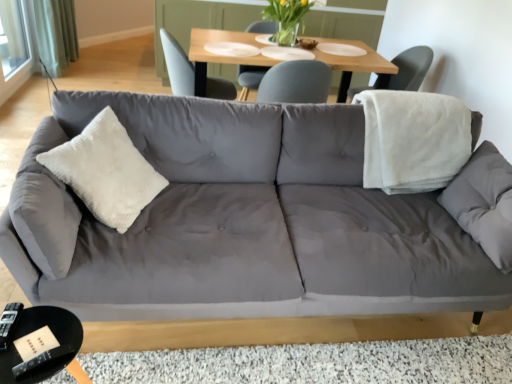
The image size is (512, 384). What do you see at coordinates (13, 36) in the screenshot? I see `transparent glass window screen at upper left` at bounding box center [13, 36].

In order to face matte gray chair at upper center, acting as the 1th chair starting from the left, should I rotate leftwards or rightwards?

You should look left and rotate roughly 7.325 degrees.

Describe the element at coordinates (220, 55) in the screenshot. This screenshot has width=512, height=384. I see `wooden table at upper center` at that location.

Where is `translucent glass vase at upper center`? This screenshot has width=512, height=384. translucent glass vase at upper center is located at coordinates (287, 13).

The height and width of the screenshot is (384, 512). What do you see at coordinates (106, 171) in the screenshot?
I see `white corduroy pillow at center` at bounding box center [106, 171].

You are a GUI agent. You are given a task and a screenshot of the screen. Output one action in this format:
    pyautogui.click(x=<x>, y=<y>)
    Task: Click on the translucent glass vase at upper center
    This screenshot has height=384, width=512.
    Given the screenshot: What is the action you would take?
    pyautogui.click(x=285, y=35)

Would you say gray fabric couch at center is inside or outside transparent glass window screen at upper left?

gray fabric couch at center exists outside the volume of transparent glass window screen at upper left.

Is gray fabric couch at center to the left or to the right of transparent glass window screen at upper left in the image?

Clearly, gray fabric couch at center is on the right of transparent glass window screen at upper left in the image.

Is gray fabric couch at center oriented away from transparent glass window screen at upper left?

That's right, gray fabric couch at center is facing away from transparent glass window screen at upper left.

Is translucent glass vase at upper center a part of matte gray chair at upper center, acting as the 1th chair starting from the left?

No, matte gray chair at upper center, acting as the 1th chair starting from the left, does not contain translucent glass vase at upper center.

Are matte gray chair at upper center, acting as the 1th chair starting from the left, and translucent glass vase at upper center beside each other?

matte gray chair at upper center, acting as the 1th chair starting from the left, and translucent glass vase at upper center are clearly separated.

In the scene shown: Can you tell me how much matte gray chair at upper center, acting as the 1th chair starting from the left, and translucent glass vase at upper center differ in facing direction?

84 degrees separate the facing orientations of matte gray chair at upper center, acting as the 1th chair starting from the left, and translucent glass vase at upper center.

From the picture: Considering the positions of objects matte gray chair at upper center, acting as the 1th chair starting from the left, and translucent glass vase at upper center in the image provided, who is more to the left, matte gray chair at upper center, acting as the 1th chair starting from the left, or translucent glass vase at upper center?

matte gray chair at upper center, acting as the 1th chair starting from the left.

Measure the distance from white corduroy pillow at center to white textured chair at upper right, marked as the 1th chair in a right-to-left arrangement.

white corduroy pillow at center and white textured chair at upper right, marked as the 1th chair in a right-to-left arrangement, are 2.30 meters apart from each other.

Is white corduroy pillow at center looking in the opposite direction of white textured chair at upper right, the second chair in the left-to-right sequence?

No.

From the picture: Between white corduroy pillow at center and white textured chair at upper right, marked as the 1th chair in a right-to-left arrangement, which one has larger size?

Bigger between the two is white textured chair at upper right, marked as the 1th chair in a right-to-left arrangement.

From the picture: Based on their positions, is white corduroy pillow at center located to the left or right of white textured chair at upper right, marked as the 1th chair in a right-to-left arrangement?

From the image, it's evident that white corduroy pillow at center is to the left of white textured chair at upper right, marked as the 1th chair in a right-to-left arrangement.

Is translucent glass vase at upper center taller or shorter than white corduroy pillow at center?

In the image, translucent glass vase at upper center appears to be shorter than white corduroy pillow at center.

Is translucent glass vase at upper center located outside white corduroy pillow at center?

translucent glass vase at upper center is positioned outside white corduroy pillow at center.

Which object is thinner, translucent glass vase at upper center or white corduroy pillow at center?

translucent glass vase at upper center.

From the image's perspective, which one is positioned lower, white textured chair at upper right, the second chair in the left-to-right sequence, or matte gray chair at upper center, acting as the 1th chair starting from the left?

matte gray chair at upper center, acting as the 1th chair starting from the left, is shown below in the image.

Considering the relative positions of white textured chair at upper right, marked as the 1th chair in a right-to-left arrangement, and matte gray chair at upper center, which appears as the 2th chair when viewed from the right, in the image provided, is white textured chair at upper right, marked as the 1th chair in a right-to-left arrangement, to the left or to the right of matte gray chair at upper center, which appears as the 2th chair when viewed from the right,?

In the image, white textured chair at upper right, marked as the 1th chair in a right-to-left arrangement, appears on the right side of matte gray chair at upper center, which appears as the 2th chair when viewed from the right.

Identify the location of chair below the white textured chair at upper right, the second chair in the left-to-right sequence (from the image's perspective). The image size is (512, 384). (177, 66).

Is translucent glass vase at upper center shorter than transparent glass window screen at upper left?

Indeed, translucent glass vase at upper center has a lesser height compared to transparent glass window screen at upper left.

How different are the orientations of translucent glass vase at upper center and transparent glass window screen at upper left in degrees?

The angular difference between translucent glass vase at upper center and transparent glass window screen at upper left is 90.9 degrees.

Is translucent glass vase at upper center positioned with its back to transparent glass window screen at upper left?

No, translucent glass vase at upper center's orientation is not away from transparent glass window screen at upper left.

Does point (279, 31) come in front of point (3, 33)?

That is True.

Is matte gray chair at upper center, acting as the 1th chair starting from the left, completely or partially outside of white corduroy pillow at center?

matte gray chair at upper center, acting as the 1th chair starting from the left, is positioned outside white corduroy pillow at center.

From a real-world perspective, is matte gray chair at upper center, acting as the 1th chair starting from the left, positioned under white corduroy pillow at center based on gravity?

Yes.

Looking at this image, can you confirm if matte gray chair at upper center, acting as the 1th chair starting from the left, is taller than white corduroy pillow at center?

Incorrect, the height of matte gray chair at upper center, acting as the 1th chair starting from the left, is not larger of that of white corduroy pillow at center.

At what (x,y) coordinates should I click in order to perform the action: click on studio couch in front of the transparent glass window screen at upper left. Please return your answer as a coordinate pair (x, y). This screenshot has height=384, width=512. Looking at the image, I should click on (241, 222).

You are a GUI agent. You are given a task and a screenshot of the screen. Output one action in this format:
    pyautogui.click(x=<x>, y=<y>)
    Task: Click on the chair that is on the left side of translucent glass vase at upper center
    Image resolution: width=512 pixels, height=384 pixels.
    Given the screenshot: What is the action you would take?
    pyautogui.click(x=177, y=66)

Based on their spatial positions, is white textured chair at upper right, marked as the 1th chair in a right-to-left arrangement, or translucent glass vase at upper center closer to black glossy coffee table at lower left?

translucent glass vase at upper center.

Estimate the real-world distances between objects in this image. Which object is closer to translucent glass vase at upper center, gray fabric couch at center or black glossy coffee table at lower left?

gray fabric couch at center is closer to translucent glass vase at upper center.

Looking at the image, which one is located closer to black glossy coffee table at lower left, transparent glass window screen at upper left or matte gray chair at upper center, which appears as the 2th chair when viewed from the right?

matte gray chair at upper center, which appears as the 2th chair when viewed from the right, lies closer to black glossy coffee table at lower left than the other object.

Based on their spatial positions, is black glossy coffee table at lower left or matte gray chair at upper center, acting as the 1th chair starting from the left, further from white fleece blanket at right?

black glossy coffee table at lower left is further to white fleece blanket at right.

Looking at this image, which object lies nearer to the anchor point wooden table at upper center, transparent glass window screen at upper left or translucent glass vase at upper center?

Among the two, translucent glass vase at upper center is located nearer to wooden table at upper center.

Consider the image. When comparing their distances from transparent glass window screen at upper left, does white corduroy pillow at center or translucent glass vase at upper center seem further?

The object further to transparent glass window screen at upper left is white corduroy pillow at center.

Based on their spatial positions, is white textured chair at upper right, the second chair in the left-to-right sequence, or wooden table at upper center further from matte gray chair at upper center, which appears as the 2th chair when viewed from the right?

The object further to matte gray chair at upper center, which appears as the 2th chair when viewed from the right, is white textured chair at upper right, the second chair in the left-to-right sequence.

Consider the image. Considering their positions, is white textured chair at upper right, the second chair in the left-to-right sequence, positioned further to gray fabric couch at center than white fleece blanket at right?

Among the two, white textured chair at upper right, the second chair in the left-to-right sequence, is located further to gray fabric couch at center.

Locate an element on the screen. The height and width of the screenshot is (384, 512). blanket between gray fabric couch at center and translucent glass vase at upper center along the z-axis is located at coordinates (413, 140).

The image size is (512, 384). I want to click on throw pillow located between transparent glass window screen at upper left and translucent glass vase at upper center in the left-right direction, so click(106, 171).

Identify the location of flower positioned between white fleece blanket at right and white textured chair at upper right, the second chair in the left-to-right sequence, from near to far. (287, 13).

Identify the location of blanket between black glossy coffee table at lower left and wooden table at upper center from front to back. (413, 140).